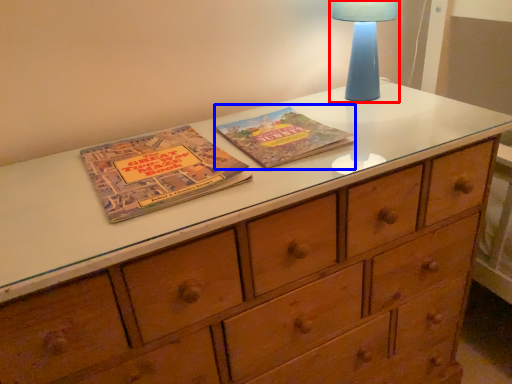
Question: Among these objects, which one is farthest to the camera, bedside lamp (highlighted by a red box) or paperback book (highlighted by a blue box)?

Choices:
 (A) bedside lamp
 (B) paperback book

Answer: (A)